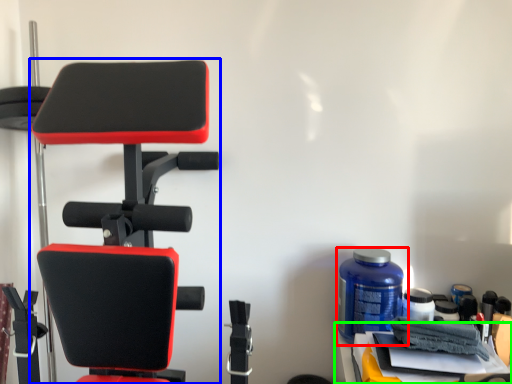
Question: Based on their relative distances, which object is farther from bottle (highlighted by a red box)? Choose from chair (highlighted by a blue box) and table (highlighted by a green box).

Choices:
 (A) chair
 (B) table

Answer: (A)